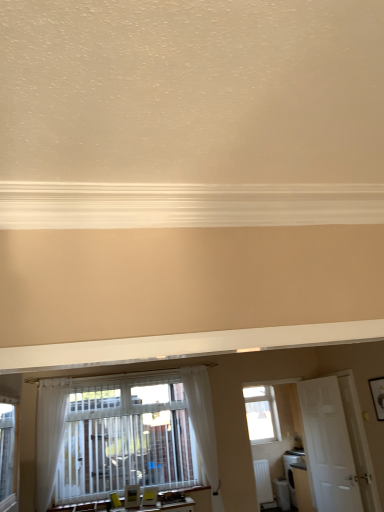
Question: Can you confirm if clear glass window at center is positioned to the left of white sheer curtain at lower left, arranged as the 1th curtain when viewed from the left?

Choices:
 (A) no
 (B) yes

Answer: (A)

Question: Is clear glass window at center outside white sheer curtain at lower left, arranged as the 1th curtain when viewed from the left?

Choices:
 (A) no
 (B) yes

Answer: (B)

Question: Is clear glass window at center positioned behind white sheer curtain at lower left, which is counted as the 2th curtain, starting from the right?

Choices:
 (A) no
 (B) yes

Answer: (B)

Question: Is clear glass window at center shorter than white sheer curtain at lower left, arranged as the 1th curtain when viewed from the left?

Choices:
 (A) yes
 (B) no

Answer: (A)

Question: Considering the relative sizes of clear glass window at center and white sheer curtain at lower left, arranged as the 1th curtain when viewed from the left, in the image provided, is clear glass window at center thinner than white sheer curtain at lower left, arranged as the 1th curtain when viewed from the left,?

Choices:
 (A) yes
 (B) no

Answer: (A)

Question: Based on their sizes in the image, would you say white wooden door at right is bigger or smaller than white sheer curtain at lower left, arranged as the 1th curtain when viewed from the left?

Choices:
 (A) big
 (B) small

Answer: (A)

Question: In terms of height, does white wooden door at right look taller or shorter compared to white sheer curtain at lower left, which is counted as the 2th curtain, starting from the right?

Choices:
 (A) tall
 (B) short

Answer: (A)

Question: Considering their positions, is white wooden door at right located in front of or behind white sheer curtain at lower left, arranged as the 1th curtain when viewed from the left?

Choices:
 (A) front
 (B) behind

Answer: (B)

Question: Is white wooden door at right to the left or to the right of white sheer curtain at lower left, which is counted as the 2th curtain, starting from the right, in the image?

Choices:
 (A) right
 (B) left

Answer: (A)

Question: Is white plastic radiator at lower right inside the boundaries of white wooden door at right, or outside?

Choices:
 (A) inside
 (B) outside

Answer: (B)

Question: In terms of height, does white plastic radiator at lower right look taller or shorter compared to white wooden door at right?

Choices:
 (A) short
 (B) tall

Answer: (A)

Question: In terms of width, does white plastic radiator at lower right look wider or thinner when compared to white wooden door at right?

Choices:
 (A) thin
 (B) wide

Answer: (B)

Question: Based on their sizes in the image, would you say white plastic radiator at lower right is bigger or smaller than white wooden door at right?

Choices:
 (A) big
 (B) small

Answer: (B)

Question: Based on their positions, is white plastic radiator at lower right located to the left or right of clear glass window at center?

Choices:
 (A) right
 (B) left

Answer: (A)

Question: Do you think white plastic radiator at lower right is within clear glass window at center, or outside of it?

Choices:
 (A) outside
 (B) inside

Answer: (A)